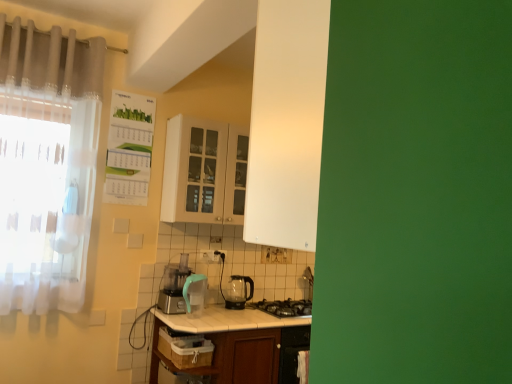
Question: Is white glossy table at center to the left of white sheer curtain at left, which is the 2th curtain in top-to-bottom order, from the viewer's perspective?

Choices:
 (A) yes
 (B) no

Answer: (B)

Question: From the image's perspective, is white glossy table at center over white sheer curtain at left, which is the 2th curtain in top-to-bottom order?

Choices:
 (A) no
 (B) yes

Answer: (A)

Question: From a real-world perspective, is white glossy table at center located higher than white sheer curtain at left, which is the 2th curtain in top-to-bottom order?

Choices:
 (A) no
 (B) yes

Answer: (A)

Question: Would you consider white glossy table at center to be distant from white sheer curtain at left, which is the 1th curtain in bottom-to-top order?

Choices:
 (A) yes
 (B) no

Answer: (A)

Question: From a real-world perspective, is white glossy table at center physically below white sheer curtain at left, which is the 1th curtain in bottom-to-top order?

Choices:
 (A) yes
 (B) no

Answer: (A)

Question: Could white sheer curtain at left, which is the 1th curtain in bottom-to-top order, be considered to be inside white glossy table at center?

Choices:
 (A) no
 (B) yes

Answer: (A)

Question: Considering the relative sizes of black glass gas stove at lower center and white sheer curtain at left, which is the 1th curtain in bottom-to-top order, in the image provided, is black glass gas stove at lower center smaller than white sheer curtain at left, which is the 1th curtain in bottom-to-top order,?

Choices:
 (A) yes
 (B) no

Answer: (A)

Question: Is white sheer curtain at left, which is the 2th curtain in top-to-bottom order, a part of black glass gas stove at lower center?

Choices:
 (A) yes
 (B) no

Answer: (B)

Question: From the image's perspective, is black glass gas stove at lower center located beneath white sheer curtain at left, which is the 2th curtain in top-to-bottom order?

Choices:
 (A) no
 (B) yes

Answer: (B)

Question: From the image's perspective, is black glass gas stove at lower center over white sheer curtain at left, which is the 1th curtain in bottom-to-top order?

Choices:
 (A) no
 (B) yes

Answer: (A)

Question: Is the depth of black glass gas stove at lower center less than that of white sheer curtain at left, which is the 1th curtain in bottom-to-top order?

Choices:
 (A) no
 (B) yes

Answer: (A)

Question: Can you confirm if black glass gas stove at lower center is thinner than white sheer curtain at left, which is the 1th curtain in bottom-to-top order?

Choices:
 (A) yes
 (B) no

Answer: (B)

Question: From a real-world perspective, is white sheer curtain at left, which is the 1th curtain in bottom-to-top order, physically above matte white cabinet at center?

Choices:
 (A) yes
 (B) no

Answer: (B)